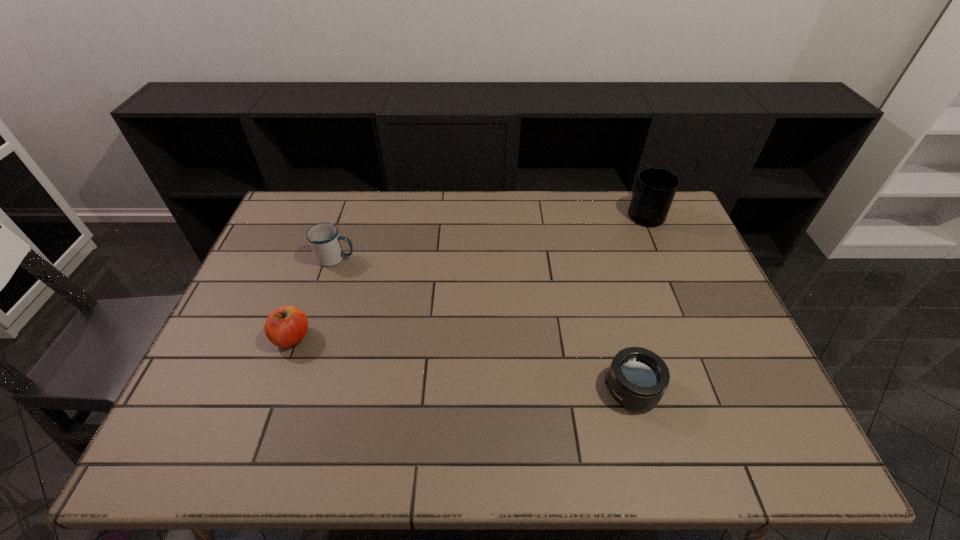
I want to click on the farther mug, so click(x=655, y=188).

Locate an element on the screen. This screenshot has height=540, width=960. the taller mug is located at coordinates [x=655, y=188].

Where is `the nearer mug`? the nearer mug is located at coordinates (324, 239).

Where is `the shorter mug`? This screenshot has height=540, width=960. the shorter mug is located at coordinates (324, 239).

Identify the location of apple. The image size is (960, 540). 286,326.

The width and height of the screenshot is (960, 540). I want to click on telephoto lens, so click(x=637, y=379).

Identify the location of the third object from left to right. This screenshot has height=540, width=960. (637, 379).

Identify the location of vacant space situated 0.160m on the handle side of the shorter mug. (407, 258).

Identify the location of blank space located on the back of the apple. The height and width of the screenshot is (540, 960). (322, 257).

At what (x,y) coordinates should I click in order to perform the action: click on vacant area situated 0.110m on the side of the shortest object with brand markings and control switches. Please return your answer as a coordinate pair (x, y). Looking at the image, I should click on (558, 389).